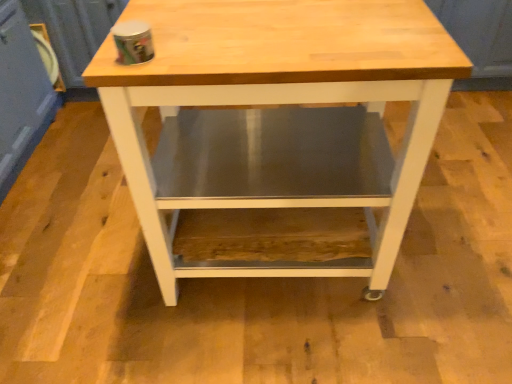
The height and width of the screenshot is (384, 512). Find the location of `free space above natural wood table at center (from a real-world perspective)`. free space above natural wood table at center (from a real-world perspective) is located at coordinates (275, 28).